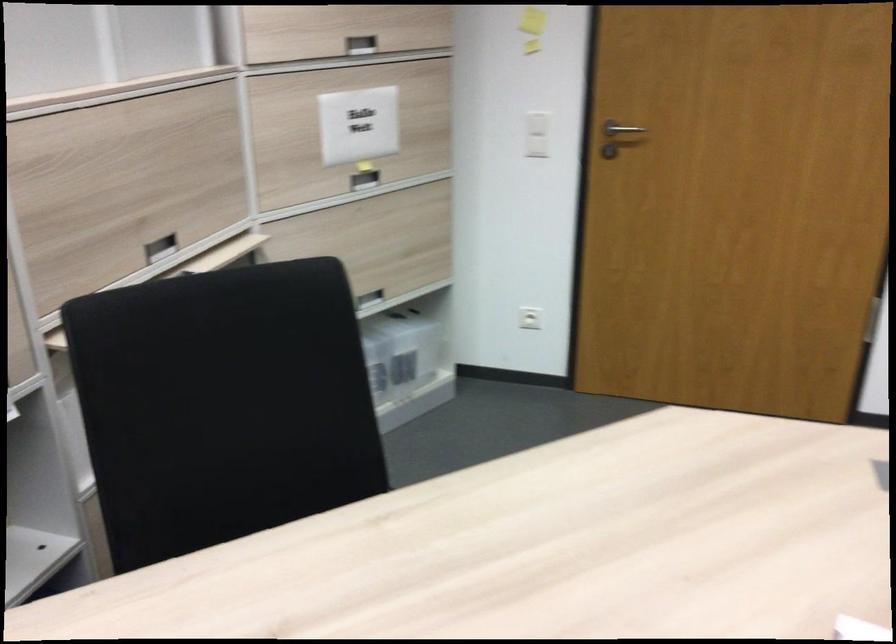
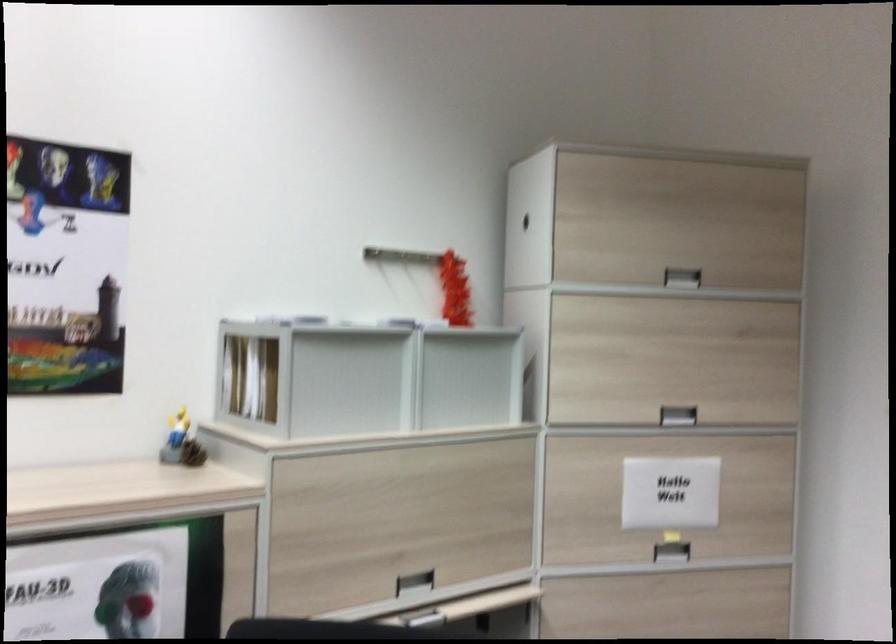
In the second image, find the point that corresponds to point 364,181 in the first image.

(670, 552)